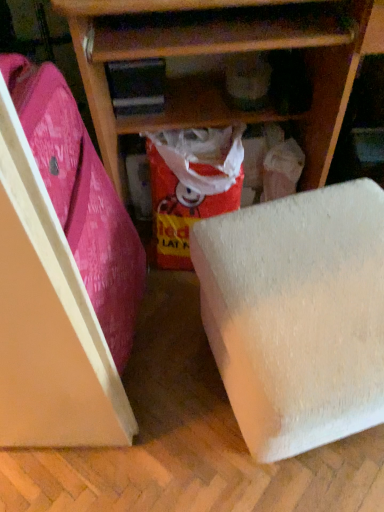
I want to click on vacant area that is in front of pink fabric suitcase at left, so 114,468.